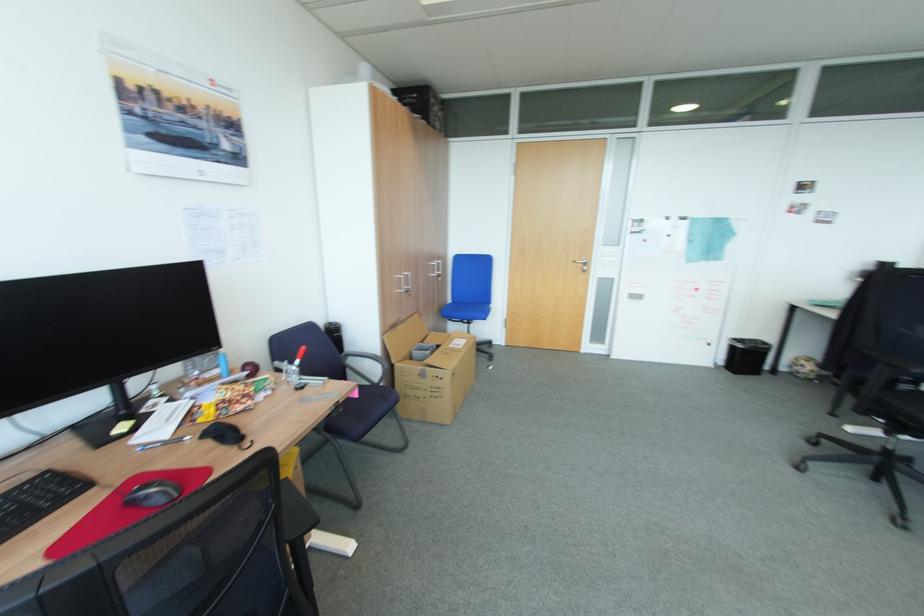
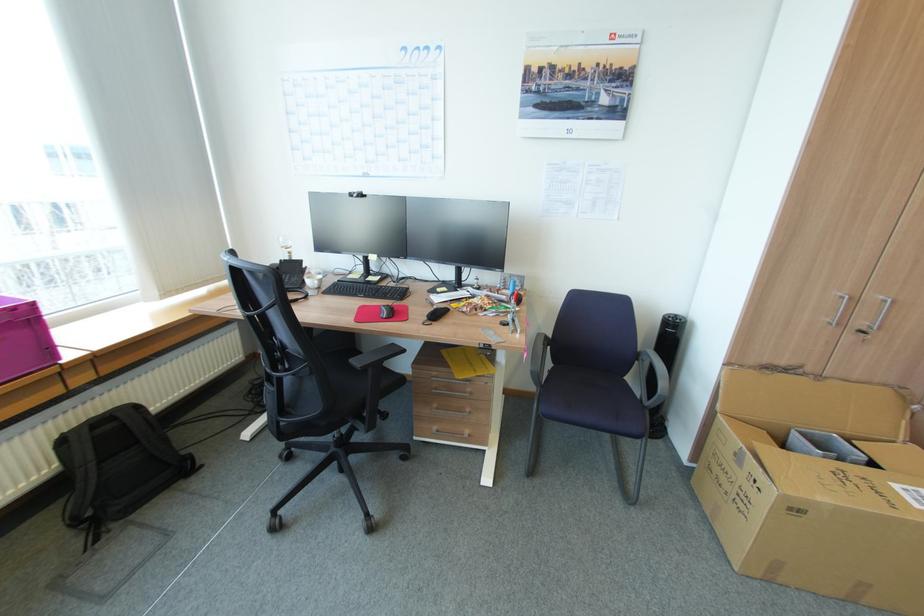
Find the pixel in the second image that matches (x=406, y=292) in the first image.

(833, 323)